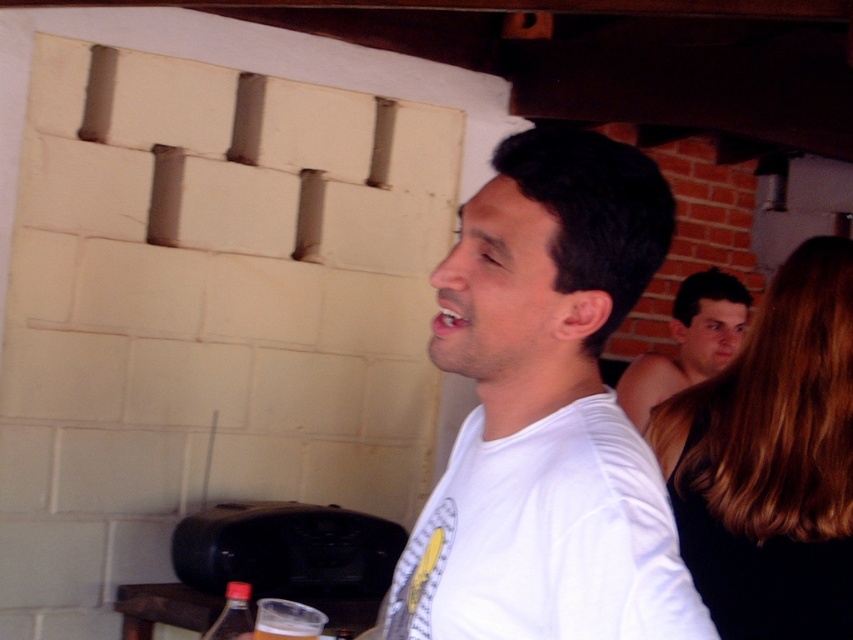
You are a bartender at a party and need to determine which object is bigger between the smooth black dress at right and the translucent plastic cup at lower center. Can you identify the larger one?

The smooth black dress at right has a larger size compared to the translucent plastic cup at lower center, so the smooth black dress at right is bigger.

You are at the point labeled point (556,518) and want to move towards the point labeled point (265,637). Considering the spatial relationship between these two points, which direction should you move to get closer to your destination?

Since point (556,518) is closer to the viewer than point (265,637), you should move forward to get closer to your destination.

You are a photographer at this event and want to capture a photo that includes both the white matte shirt at center and the smooth skin face at upper right. Based on their positions, which object should you focus on first to ensure both are in frame?

The white matte shirt at center has a greater height compared to the smooth skin face at upper right, so focusing on the white matte shirt at center first would ensure both are in frame.